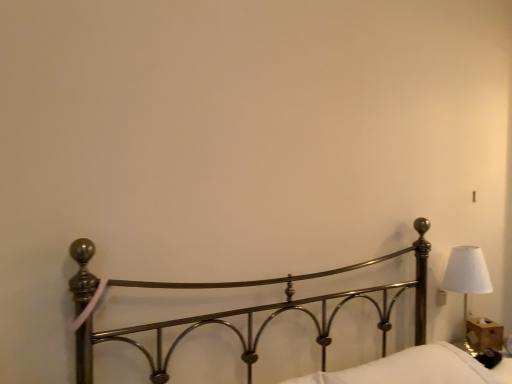
Question: Is polished metal bed at center with white soft pillow at lower right?

Choices:
 (A) no
 (B) yes

Answer: (A)

Question: Is polished metal bed at center taller than white soft pillow at lower right?

Choices:
 (A) yes
 (B) no

Answer: (A)

Question: Is polished metal bed at center positioned beyond the bounds of white soft pillow at lower right?

Choices:
 (A) yes
 (B) no

Answer: (A)

Question: Does polished metal bed at center appear on the left side of white soft pillow at lower right?

Choices:
 (A) no
 (B) yes

Answer: (B)

Question: Can you confirm if polished metal bed at center is smaller than white soft pillow at lower right?

Choices:
 (A) no
 (B) yes

Answer: (A)

Question: In the image, is polished metal bed at center positioned in front of or behind white fabric lampshade at right?

Choices:
 (A) behind
 (B) front

Answer: (B)

Question: From the image's perspective, is polished metal bed at center located above or below white fabric lampshade at right?

Choices:
 (A) below
 (B) above

Answer: (B)

Question: In the image, is polished metal bed at center on the left side or the right side of white fabric lampshade at right?

Choices:
 (A) left
 (B) right

Answer: (A)

Question: Considering the positions of polished metal bed at center and white fabric lampshade at right in the image, is polished metal bed at center wider or thinner than white fabric lampshade at right?

Choices:
 (A) wide
 (B) thin

Answer: (A)

Question: Is white fabric lampshade at right inside the boundaries of white soft pillow at lower right, or outside?

Choices:
 (A) outside
 (B) inside

Answer: (A)

Question: In terms of height, does white fabric lampshade at right look taller or shorter compared to white soft pillow at lower right?

Choices:
 (A) tall
 (B) short

Answer: (A)

Question: In terms of width, does white fabric lampshade at right look wider or thinner when compared to white soft pillow at lower right?

Choices:
 (A) wide
 (B) thin

Answer: (B)

Question: Is point (489, 289) positioned closer to the camera than point (417, 359)?

Choices:
 (A) closer
 (B) farther

Answer: (B)

Question: In terms of size, does white soft pillow at lower right appear bigger or smaller than white fabric lampshade at right?

Choices:
 (A) big
 (B) small

Answer: (A)

Question: Is white soft pillow at lower right situated inside white fabric lampshade at right or outside?

Choices:
 (A) inside
 (B) outside

Answer: (B)